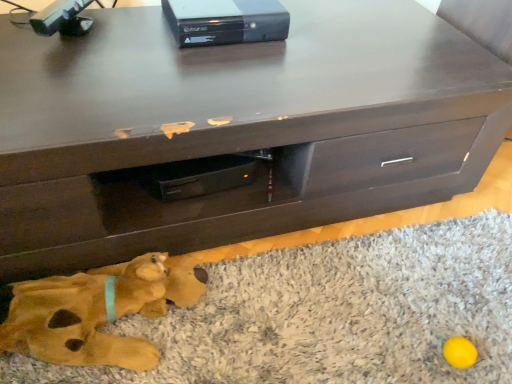
You are a GUI agent. You are given a task and a screenshot of the screen. Output one action in this format:
    pyautogui.click(x=<x>, y=<y>)
    Task: Click on the blank space above dark wood chest of drawers at center (from a real-world perspective)
    The image size is (512, 384).
    Given the screenshot: What is the action you would take?
    coord(224,51)